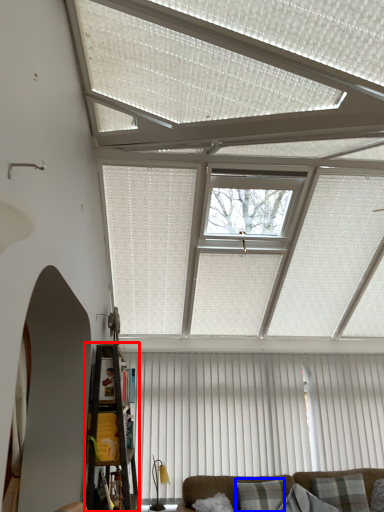
Question: Which object is closer to the camera taking this photo, shelf (highlighted by a red box) or pillow (highlighted by a blue box)?

Choices:
 (A) shelf
 (B) pillow

Answer: (A)